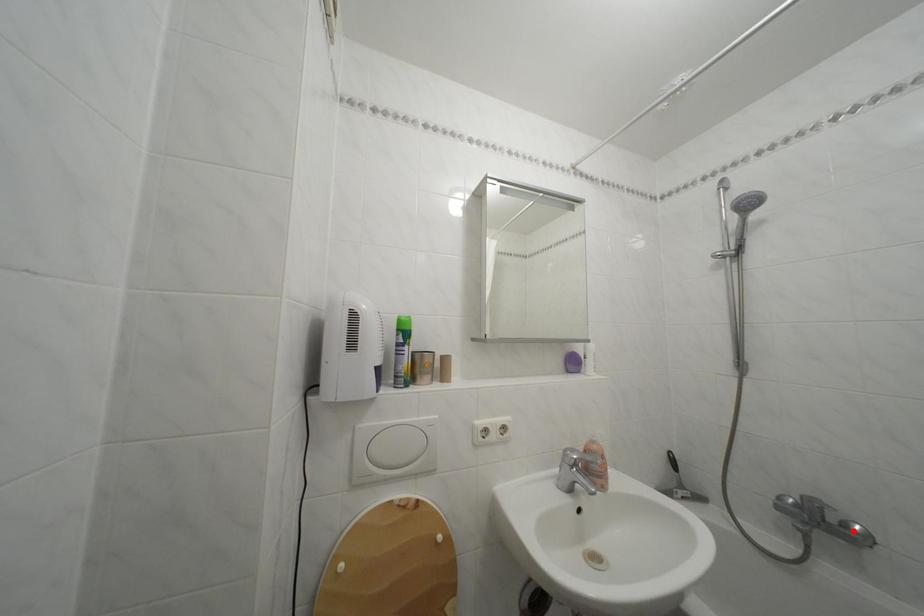
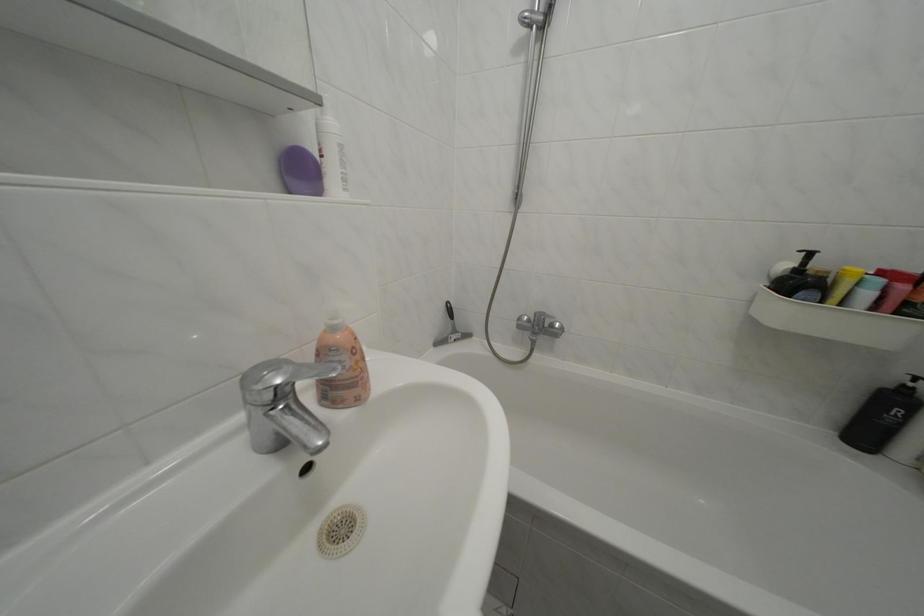
Find the pixel in the second image that matches the highlighted location in the first image.

(562, 331)